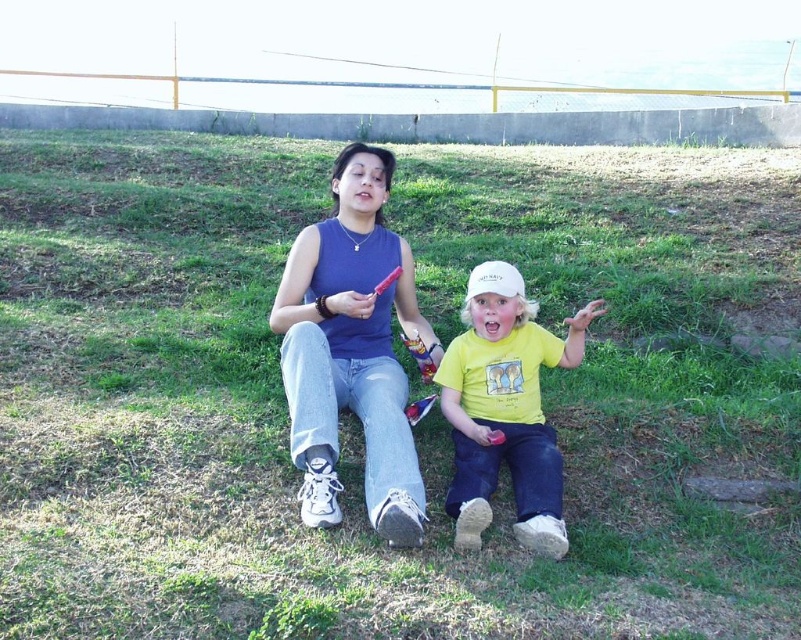
Question: Estimate the real-world distances between objects in this image. Which object is closer to the white matte baseball hat at center?

Choices:
 (A) yellow cotton shirt at center
 (B) matte blue tank top at center

Answer: (A)

Question: Among these objects, which one is farthest from the camera?

Choices:
 (A) white matte baseball hat at center
 (B) matte blue tank top at center

Answer: (A)

Question: Which point appears farthest from the camera in this image?

Choices:
 (A) (518, 278)
 (B) (506, 324)

Answer: (B)

Question: Can you confirm if matte blue tank top at center is bigger than yellow cotton shirt at center?

Choices:
 (A) yes
 (B) no

Answer: (A)

Question: Is matte blue tank top at center below white matte baseball hat at center?

Choices:
 (A) no
 (B) yes

Answer: (B)

Question: Is matte blue tank top at center to the right of yellow cotton shirt at center from the viewer's perspective?

Choices:
 (A) yes
 (B) no

Answer: (B)